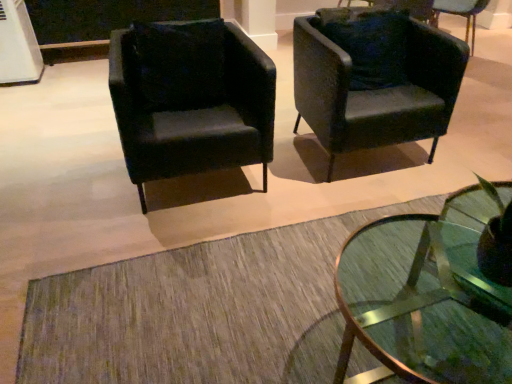
Question: From the image's perspective, is velvet black armchair at upper right, arranged as the third chair when viewed from the left, located above matte black armchair at left, which is counted as the 3th chair, starting from the right?

Choices:
 (A) yes
 (B) no

Answer: (A)

Question: Does velvet black armchair at upper right, arranged as the third chair when viewed from the left, appear on the right side of matte black armchair at left, which is the 1th chair in left-to-right order?

Choices:
 (A) no
 (B) yes

Answer: (B)

Question: From a real-world perspective, is velvet black armchair at upper right, arranged as the third chair when viewed from the left, positioned under matte black armchair at left, which is the 1th chair in left-to-right order, based on gravity?

Choices:
 (A) no
 (B) yes

Answer: (B)

Question: Would you say velvet black armchair at upper right, arranged as the third chair when viewed from the left, contains matte black armchair at left, which is the 1th chair in left-to-right order?

Choices:
 (A) yes
 (B) no

Answer: (B)

Question: Is velvet black armchair at upper right, arranged as the third chair when viewed from the left, oriented away from matte black armchair at left, which is counted as the 3th chair, starting from the right?

Choices:
 (A) yes
 (B) no

Answer: (B)

Question: Does velvet black armchair at upper right, positioned as the first chair in right-to-left order, appear on the left side of matte black armchair at left, which is counted as the 3th chair, starting from the right?

Choices:
 (A) yes
 (B) no

Answer: (B)

Question: Is velvet dark green pillow at center to the right of matte black armchair at left, which is the 1th chair in left-to-right order, from the viewer's perspective?

Choices:
 (A) yes
 (B) no

Answer: (A)

Question: Could you tell me if velvet dark green pillow at center is turned towards matte black armchair at left, which is the 1th chair in left-to-right order?

Choices:
 (A) no
 (B) yes

Answer: (B)

Question: Is velvet dark green pillow at center in contact with matte black armchair at left, which is counted as the 3th chair, starting from the right?

Choices:
 (A) yes
 (B) no

Answer: (A)

Question: From the image's perspective, would you say velvet dark green pillow at center is shown under matte black armchair at left, which is counted as the 3th chair, starting from the right?

Choices:
 (A) yes
 (B) no

Answer: (B)

Question: From a real-world perspective, is velvet dark green pillow at center on matte black armchair at left, which is the 1th chair in left-to-right order?

Choices:
 (A) no
 (B) yes

Answer: (B)

Question: Is velvet dark green pillow at center further to the viewer compared to matte black armchair at left, which is counted as the 3th chair, starting from the right?

Choices:
 (A) no
 (B) yes

Answer: (B)

Question: Does velvet dark green pillow at center have a smaller size compared to matte black armchair at upper right, placed as the second chair when sorted from right to left?

Choices:
 (A) yes
 (B) no

Answer: (A)